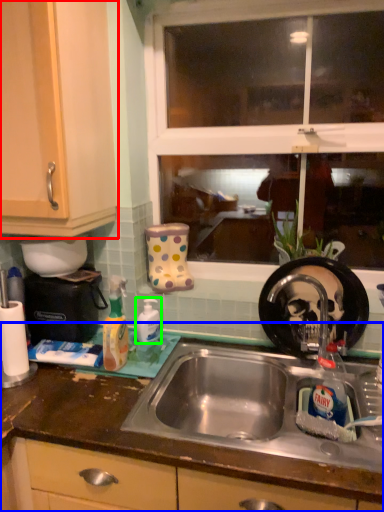
Question: Which object is the farthest from cabinetry (highlighted by a red box)? Choose among these: countertop (highlighted by a blue box) or cleaning product (highlighted by a green box).

Choices:
 (A) countertop
 (B) cleaning product

Answer: (A)